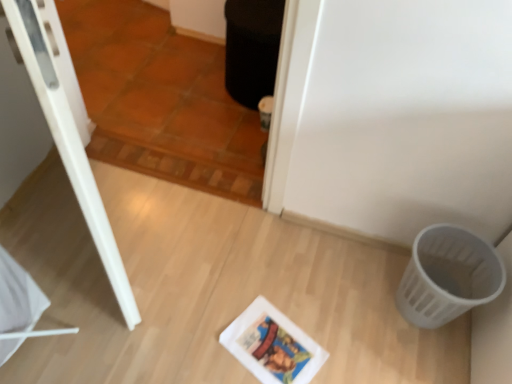
Locate an element on the screen. The width and height of the screenshot is (512, 384). vacant space that's between white plastic basket at lower right and matte white comic book at center is located at coordinates (351, 327).